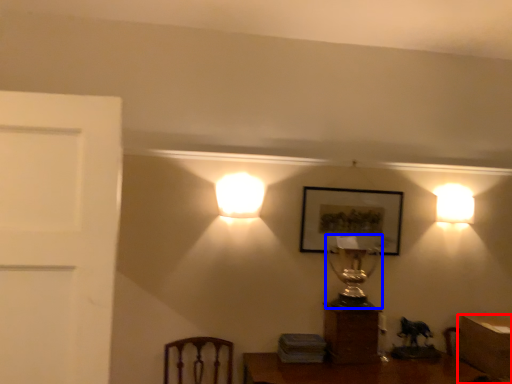
Question: Which object appears farthest to the camera in this image, table (highlighted by a red box) or table lamp (highlighted by a blue box)?

Choices:
 (A) table
 (B) table lamp

Answer: (B)